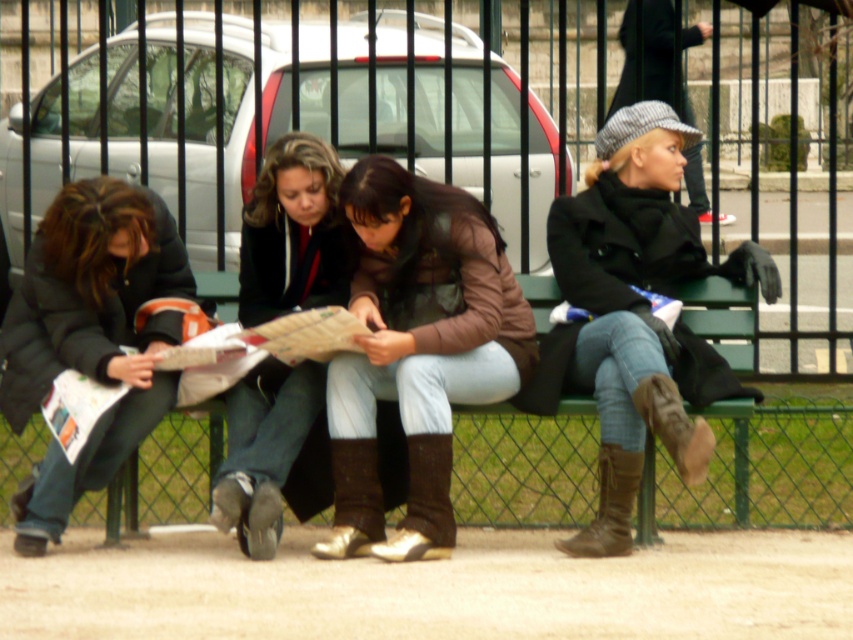
You are a delivery person who needs to park your 1.8 meters wide delivery van between the silver metallic car at center and the dark gray wool coat at left. Is there enough space between them for your van?

The silver metallic car at center might be wider than dark gray wool coat at left, so the space between them may not be sufficient for a 1.8 meters wide delivery van. Check the actual width before parking.

You are standing at the camera position and want to throw a ball to a friend who is standing at point (x=366, y=460). If the ball can travel 10 meters, will it reach them?

The distance of point (x=366, y=460) from camera is 8.57 meters, so yes, the ball can reach them as it is within the 10 meters range.

You are a pedestrian trying to cross the path in front of the bench where the brown suede boot at center and brown leather boot at lower right are placed. Can you step between them without stepping on either boot?

The brown suede boot at center is positioned over the brown leather boot at lower right, meaning there is no space between them for you to step through without touching either boot.